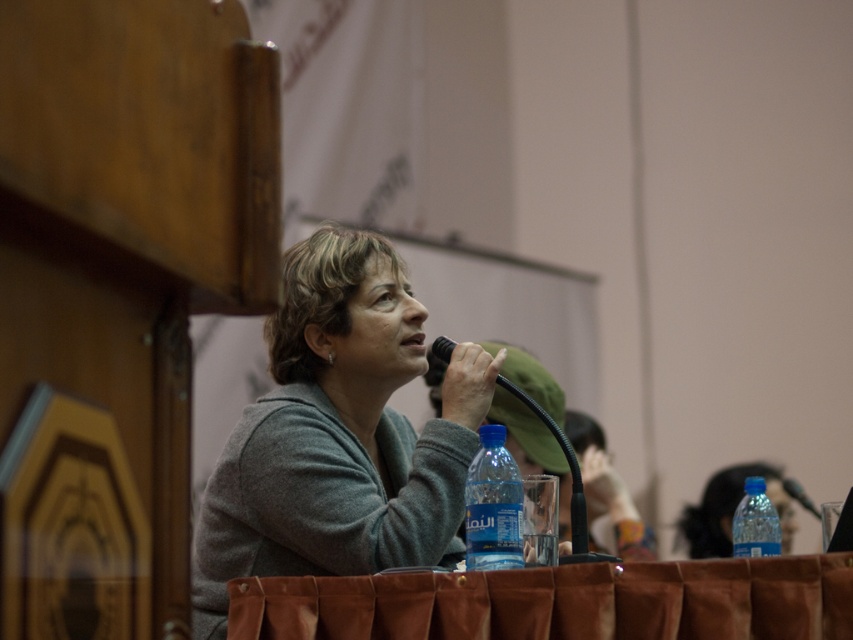
Based on the coordinates provided, which object is located at point (492, 506) in the scene?

The blue plastic bottle at lower center is located at point (492, 506).

You are a photographer at the event and need to capture a closeup of the blue plastic bottle at lower center without the gray matte sweater at center blocking it. What should you do?

The blue plastic bottle at lower center is behind the gray matte sweater at center, so you should move your camera position to a lower angle or shift the camera slightly forward to avoid the sweater blocking the view of the bottle.